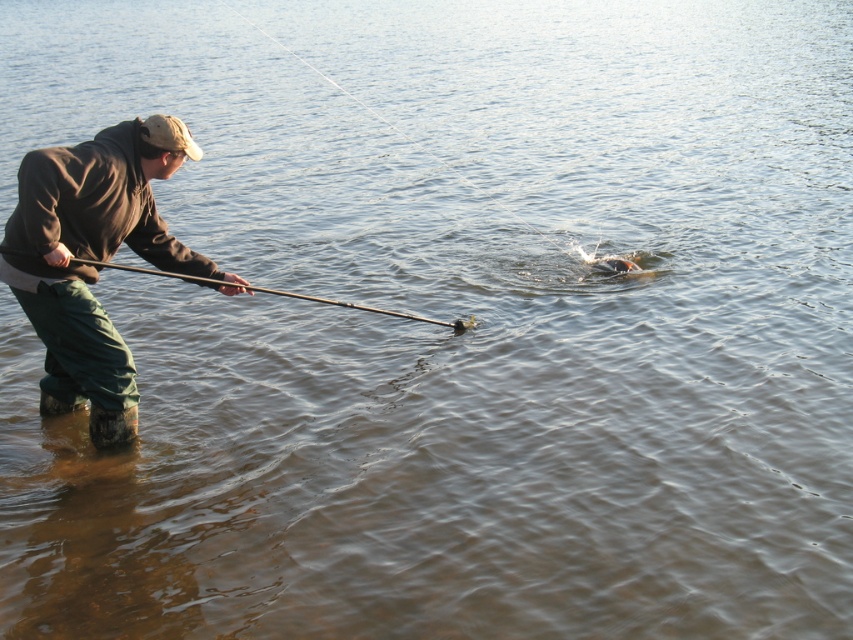
Does brown fabric jacket at left have a greater width compared to smooth black rod at center?

No, brown fabric jacket at left is not wider than smooth black rod at center.

Based on the photo, does brown fabric jacket at left appear under smooth black rod at center?

No, brown fabric jacket at left is not below smooth black rod at center.

Who is more forward, (64, 349) or (328, 298)?

Point (64, 349)

What are the coordinates of `brown fabric jacket at left` in the screenshot? It's located at (93, 259).